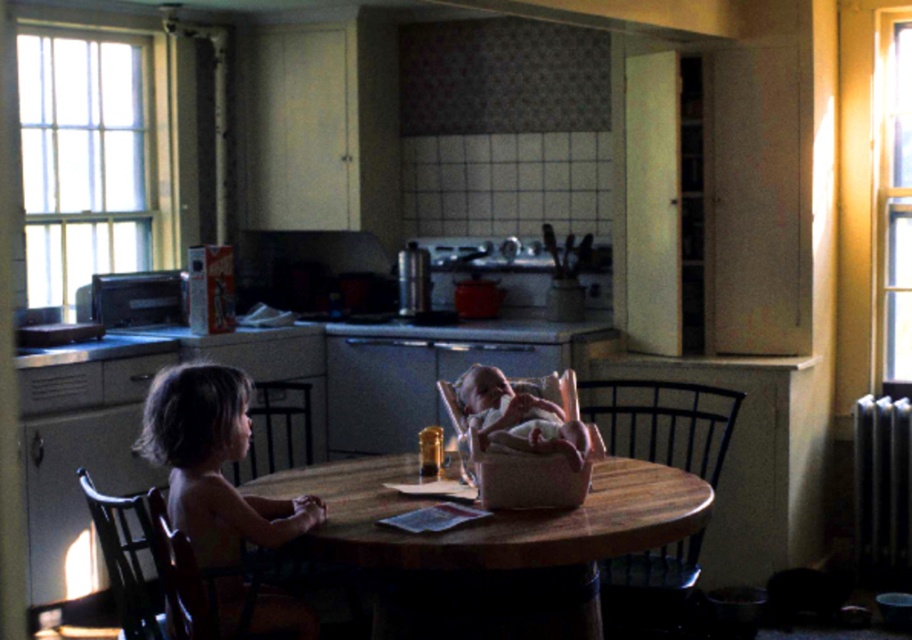
Between point (187, 513) and point (252, 396), which one is positioned in front?

Point (187, 513) is more forward.

Is light brown wooden chair at left to the left of wooden chair at left from the viewer's perspective?

No, light brown wooden chair at left is not to the left of wooden chair at left.

Describe the element at coordinates (213, 465) in the screenshot. I see `light brown wooden chair at left` at that location.

What are the coordinates of `light brown wooden chair at left` in the screenshot? It's located at (213, 465).

Is light brown wooden chair at left below wooden chair at table?

Yes, light brown wooden chair at left is below wooden chair at table.

You are a GUI agent. You are given a task and a screenshot of the screen. Output one action in this format:
    pyautogui.click(x=<x>, y=<y>)
    Task: Click on the light brown wooden chair at left
    The width and height of the screenshot is (912, 640).
    Given the screenshot: What is the action you would take?
    pyautogui.click(x=213, y=465)

At what (x,y) coordinates should I click in order to perform the action: click on light brown wooden chair at left. Please return your answer as a coordinate pair (x, y). The width and height of the screenshot is (912, 640). Looking at the image, I should click on tap(213, 465).

Can you confirm if wooden chair at table is positioned to the left of wooden chair at left?

Incorrect, wooden chair at table is not on the left side of wooden chair at left.

Which is in front, point (614, 625) or point (293, 444)?

Point (614, 625) is more forward.

Locate an element on the screen. This screenshot has width=912, height=640. wooden chair at table is located at coordinates pos(664,420).